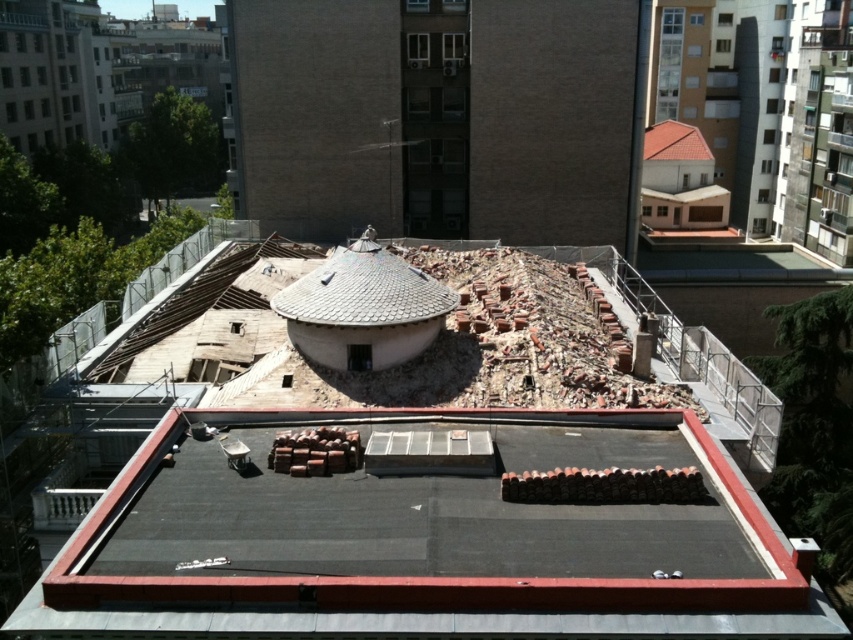
Question: Is gray tile dome at center smaller than red shingles at upper right?

Choices:
 (A) no
 (B) yes

Answer: (A)

Question: Which object is closer to the camera taking this photo?

Choices:
 (A) red shingles at upper right
 (B) brick rubble at center
 (C) gray tile dome at center

Answer: (B)

Question: Is gray tile dome at center further to the viewer compared to red shingles at upper right?

Choices:
 (A) yes
 (B) no

Answer: (B)

Question: Which of the following is the closest to the observer?

Choices:
 (A) brick rubble at center
 (B) gray tile dome at center

Answer: (A)

Question: Is brick rubble at center thinner than red shingles at upper right?

Choices:
 (A) no
 (B) yes

Answer: (A)

Question: Which object appears closest to the camera in this image?

Choices:
 (A) brick rubble at center
 (B) gray tile dome at center
 (C) black rubber roof at center
 (D) red shingles at upper right

Answer: (A)